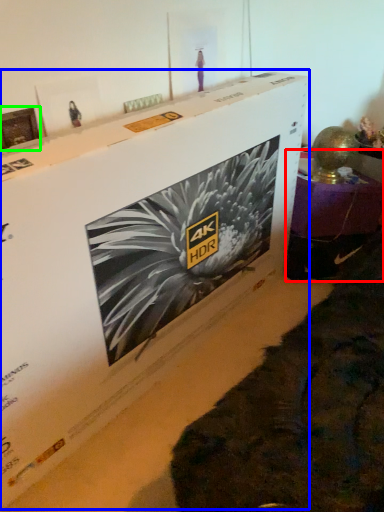
Question: Which is farther away from furniture (highlighted by a red box)? cardboard box (highlighted by a blue box) or picture frame (highlighted by a green box)?

Choices:
 (A) cardboard box
 (B) picture frame

Answer: (B)